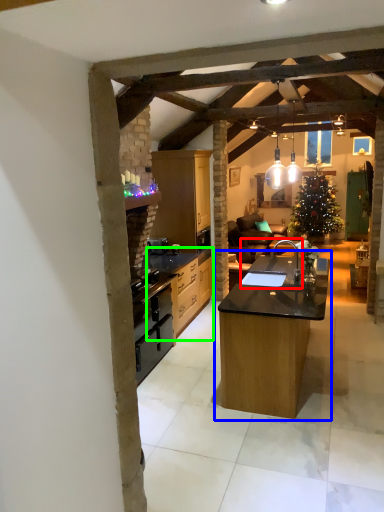
Question: Which is nearer to the sink (highlighted by a red box)? table (highlighted by a blue box) or cabinetry (highlighted by a green box).

Choices:
 (A) table
 (B) cabinetry

Answer: (A)